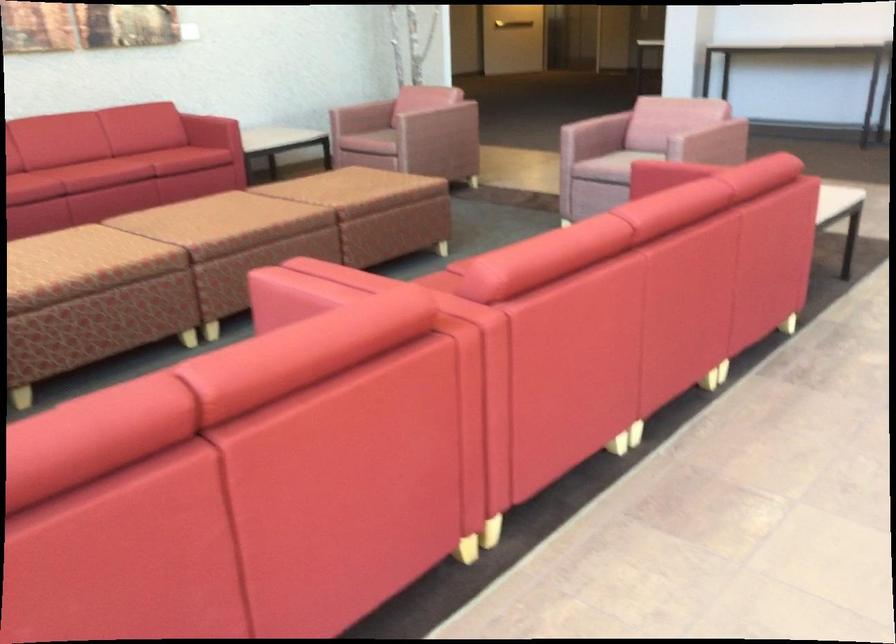
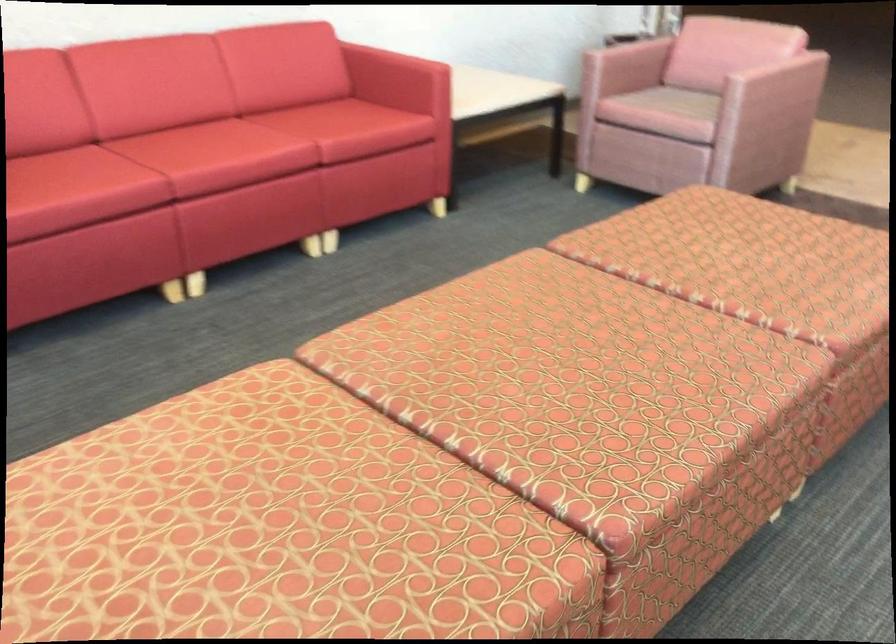
Locate, in the second image, the point that corresponds to point (213, 216) in the first image.

(549, 377)